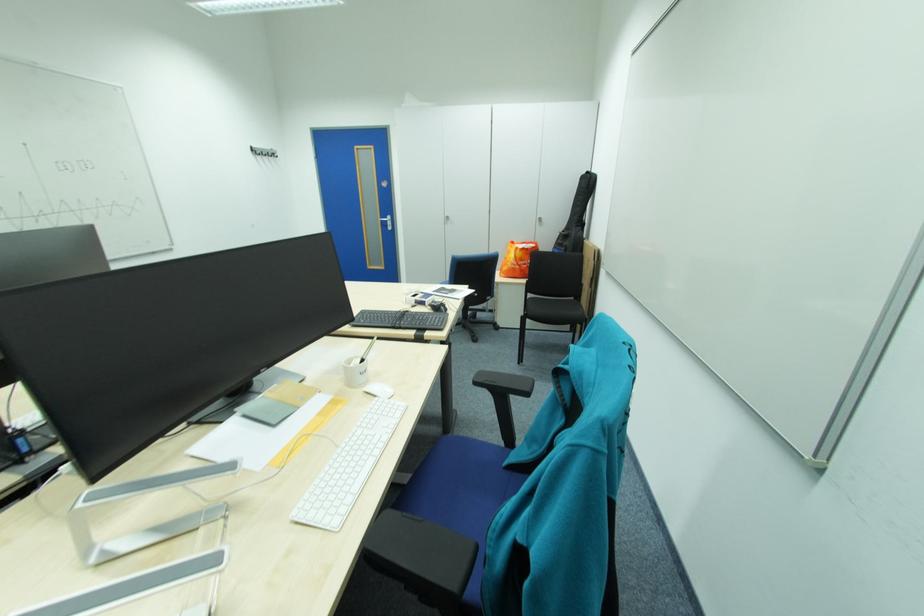
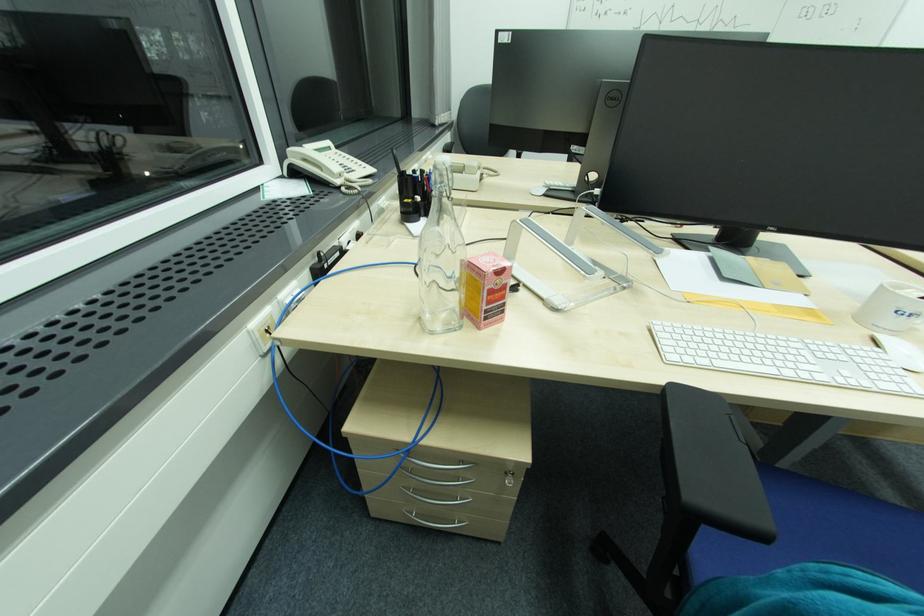
How did the camera likely rotate?

The rotation direction of the camera is left-down.